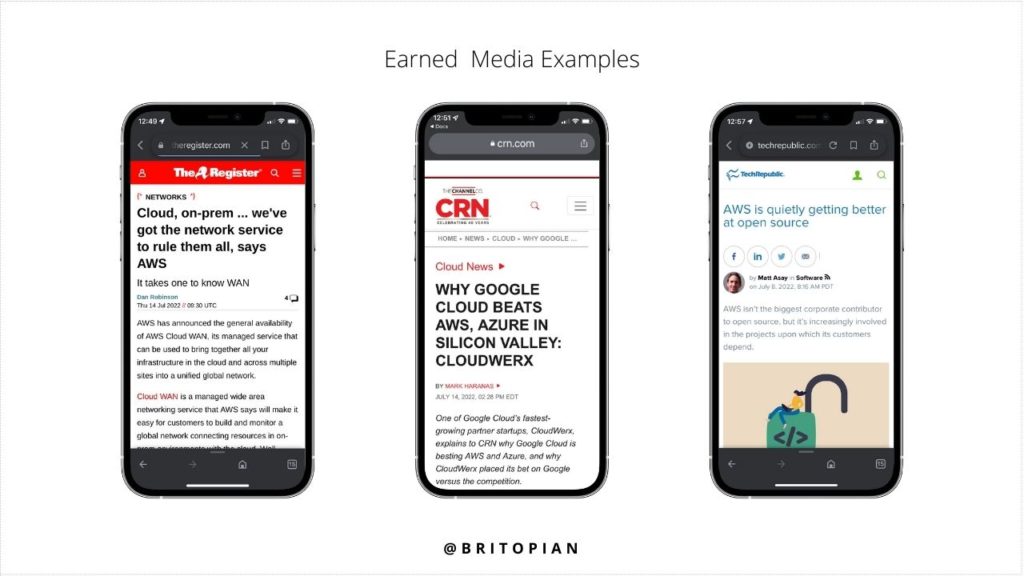
Identify the location of lock. This screenshot has width=1024, height=576. (807, 405).